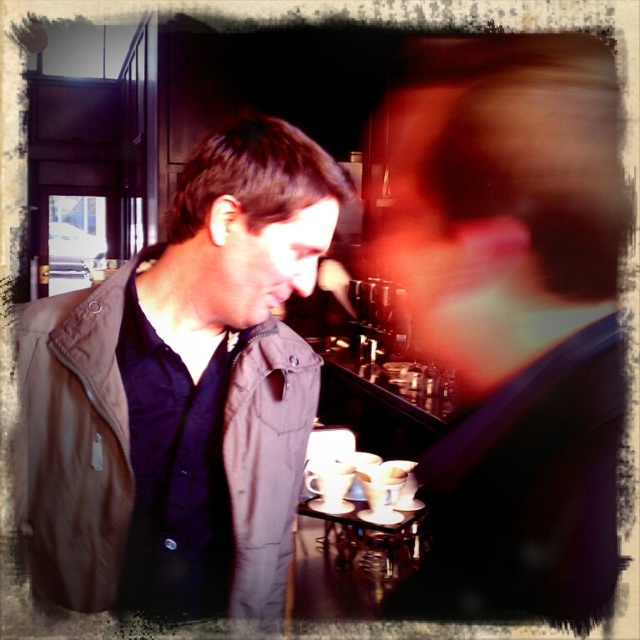
Question: Among these points, which one is farthest from the camera?

Choices:
 (A) (285, 524)
 (B) (577, 547)

Answer: (B)

Question: Is smooth brown jacket at center behind brown fabric jacket at left?

Choices:
 (A) yes
 (B) no

Answer: (A)

Question: Among these objects, which one is nearest to the camera?

Choices:
 (A) smooth brown jacket at center
 (B) brown fabric jacket at left

Answer: (B)

Question: Is smooth brown jacket at center positioned before brown fabric jacket at left?

Choices:
 (A) yes
 (B) no

Answer: (B)

Question: Is the position of smooth brown jacket at center less distant than that of brown fabric jacket at left?

Choices:
 (A) no
 (B) yes

Answer: (A)

Question: Which object appears closest to the camera in this image?

Choices:
 (A) brown fabric jacket at left
 (B) smooth brown jacket at center

Answer: (A)